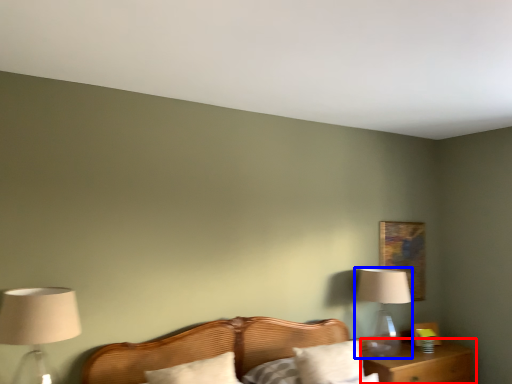
Question: Which object is further to the camera taking this photo, nightstand (highlighted by a red box) or table lamp (highlighted by a blue box)?

Choices:
 (A) nightstand
 (B) table lamp

Answer: (B)